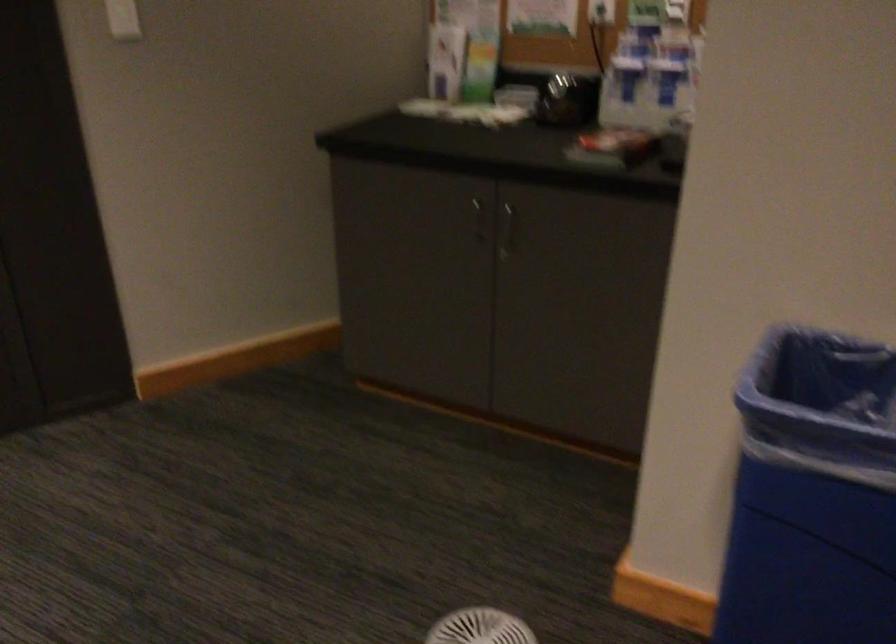
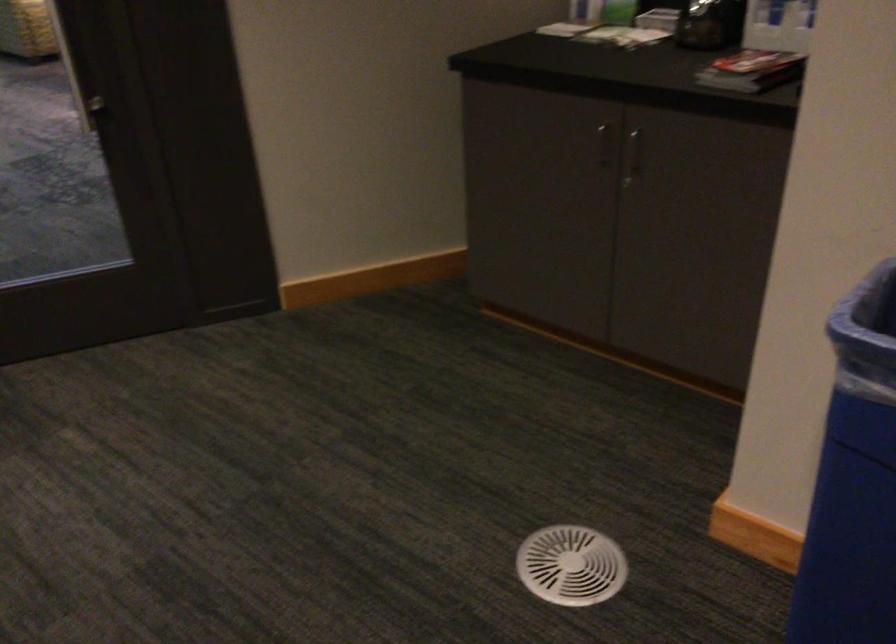
Question: The images are taken continuously from a first-person perspective. In which direction is your viewpoint rotating?

Choices:
 (A) Left
 (B) Right
 (C) Up
 (D) Down

Answer: (A)